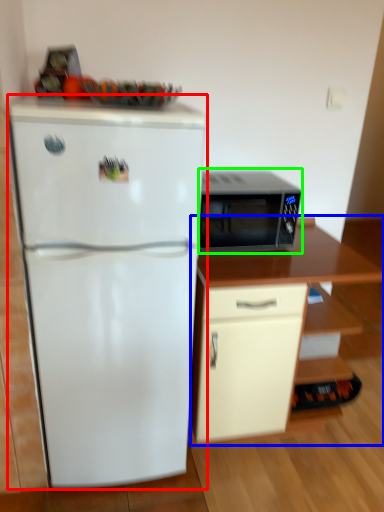
Question: Which is nearer to the refrigerator (highlighted by a red box)? cabinetry (highlighted by a blue box) or microwave oven (highlighted by a green box).

Choices:
 (A) cabinetry
 (B) microwave oven

Answer: (A)